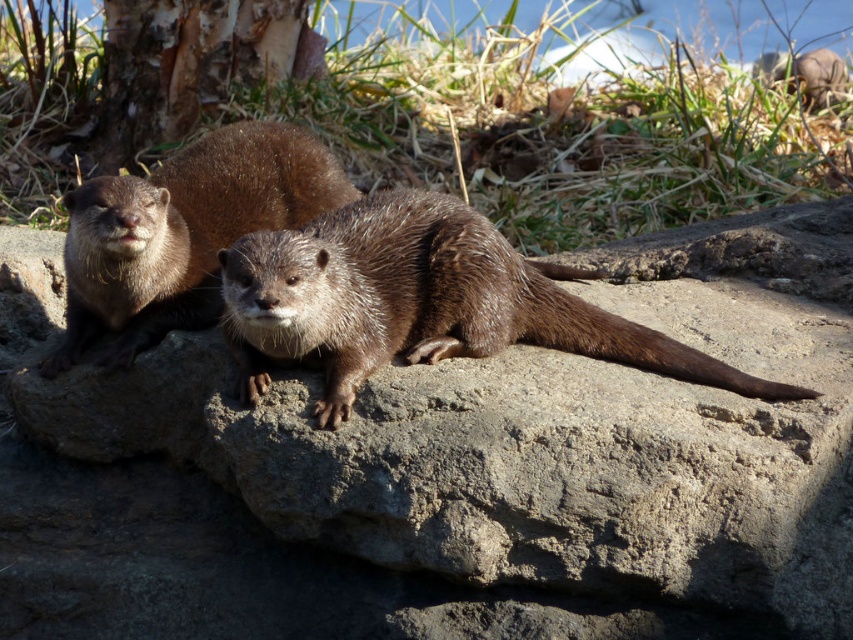
Question: Does gray rough rock at center appear under brown fuzzy otter at left?

Choices:
 (A) no
 (B) yes

Answer: (B)

Question: Based on their relative distances, which object is nearer to the brown furry otter at center?

Choices:
 (A) brown fuzzy otter at left
 (B) gray rough rock at center

Answer: (B)

Question: Which point is farther to the camera?

Choices:
 (A) (292, 170)
 (B) (624, 449)
 (C) (393, 294)

Answer: (A)

Question: Can you confirm if brown furry otter at center is positioned to the right of brown fuzzy otter at left?

Choices:
 (A) yes
 (B) no

Answer: (A)

Question: Which object is closer to the camera taking this photo?

Choices:
 (A) brown furry otter at center
 (B) gray rough rock at center

Answer: (A)

Question: Is brown furry otter at center smaller than brown fuzzy otter at left?

Choices:
 (A) yes
 (B) no

Answer: (B)